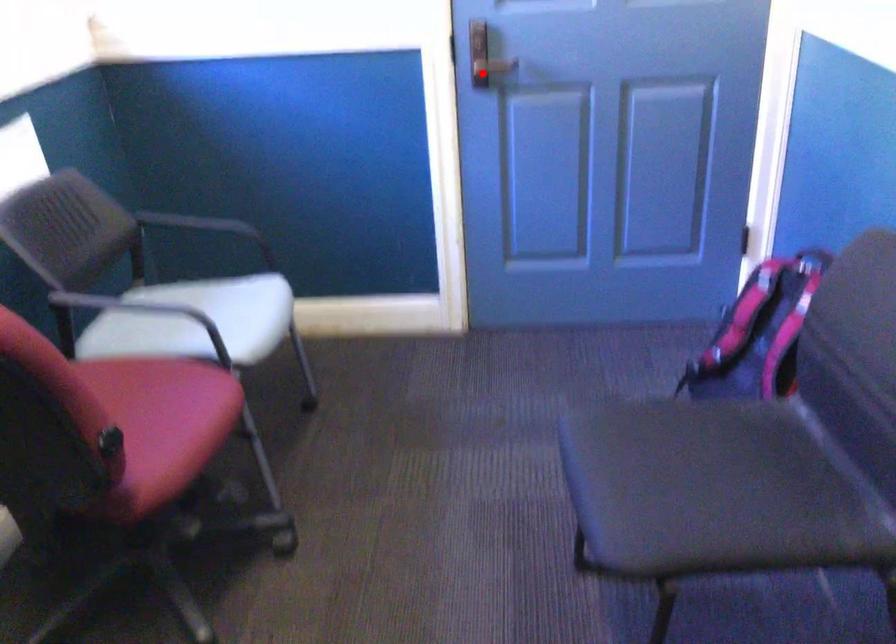
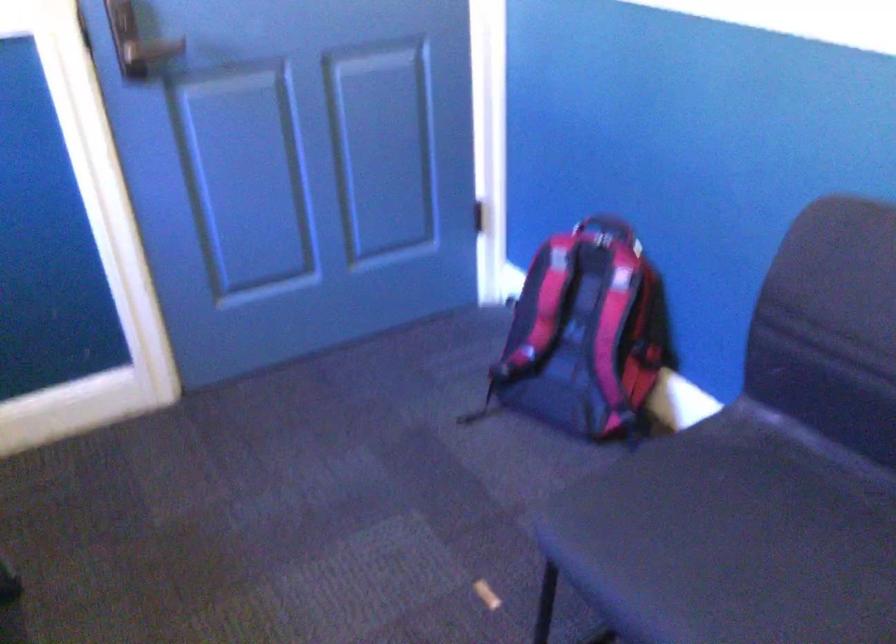
Where in the second image is the point corresponding to the highlighted location from the first image?

(152, 50)